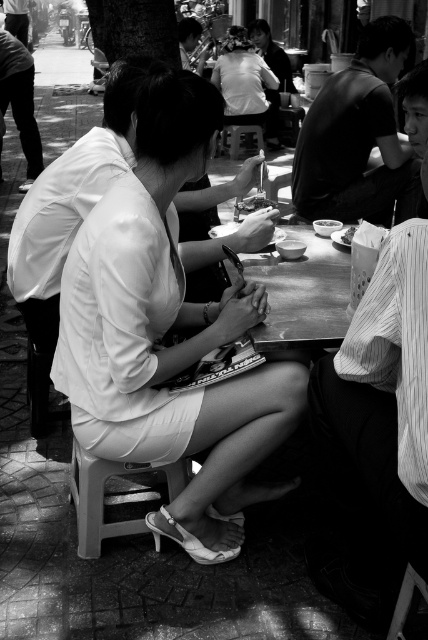
You are trying to place the smooth plastic spoon at center on the white plastic stool at lower left. Will it fit without falling off?

The white plastic stool at lower left might be wider than the smooth plastic spoon at center, so there is a possibility that the spoon will fit without falling off, but it depends on the exact dimensions and stability.

You are a photographer standing at the edge of the scene. You notice the smooth black shirt at upper right and the wooden table at center. Which object is positioned higher in the image?

The smooth black shirt at upper right is much taller than the wooden table at center, so it is positioned higher in the image.

You are a waiter at the outdoor dining area. You need to place a new drink order for the woman sitting on the white plastic stool at lower left. Where should you place the drink relative to the smooth plastic spoon at center?

The white plastic stool at lower left is to the left of the smooth plastic spoon at center, so you should place the drink to the left of the smooth plastic spoon at center near the woman.